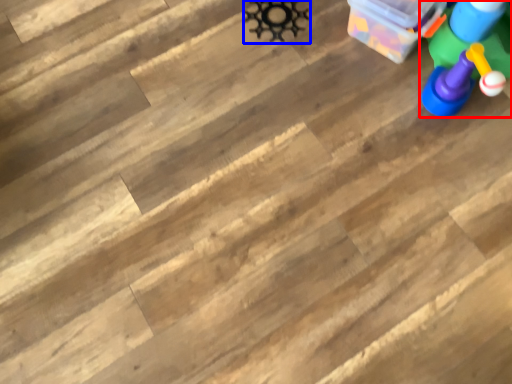
Question: Which of the following is the farthest to the observer, toy (highlighted by a red box) or toy (highlighted by a blue box)?

Choices:
 (A) toy
 (B) toy

Answer: (B)